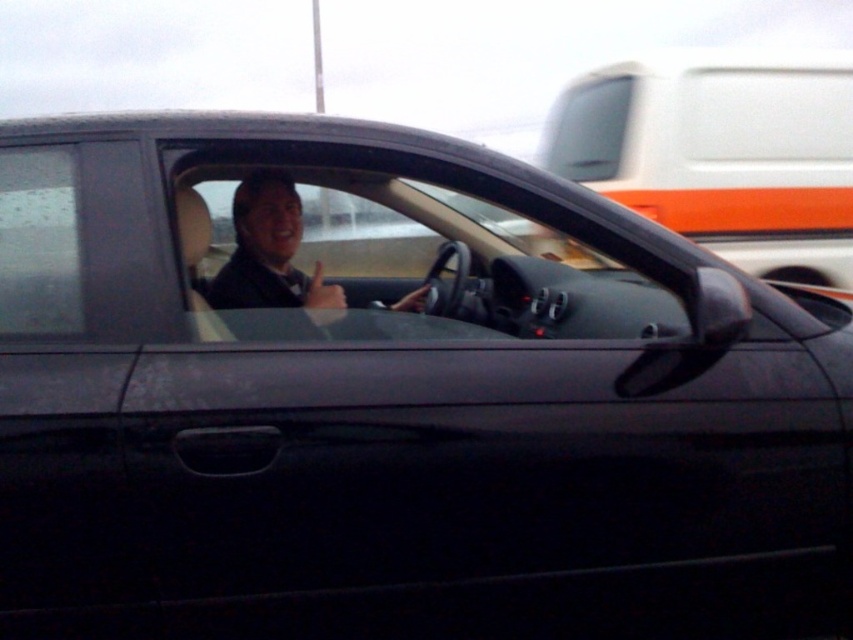
Does transparent glass window at center have a greater height compared to matte black suit at center?

Yes.

Between point (239, 225) and point (254, 214), which one is positioned behind?

Positioned behind is point (239, 225).

This screenshot has height=640, width=853. Find the location of `transparent glass window at center`. transparent glass window at center is located at coordinates (386, 260).